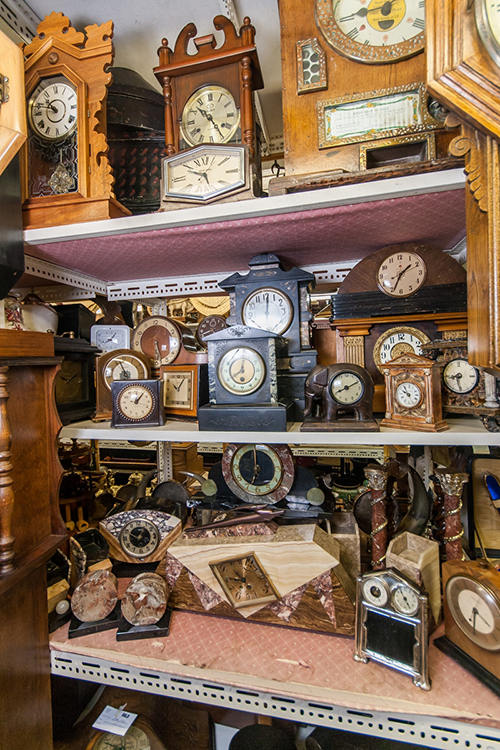
I want to click on metal shelves, so click(181, 680), click(202, 439), click(165, 217), click(74, 301), click(177, 289).